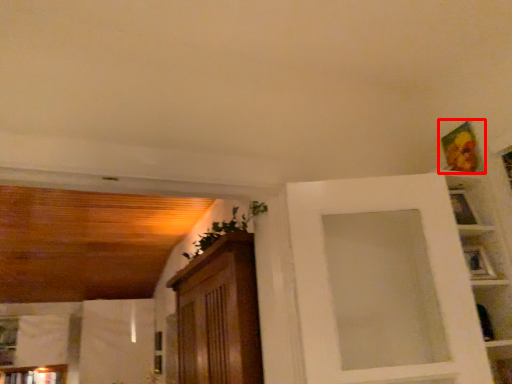
Question: From the image's perspective, what is the correct spatial positioning of picture frame (annotated by the red box) in reference to picture frame?

Choices:
 (A) above
 (B) below

Answer: (A)